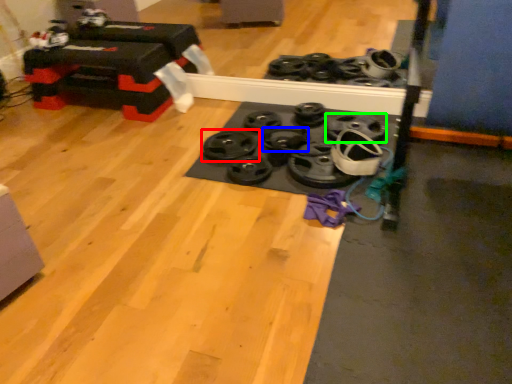
Question: Which object is positioned farthest from wheel (highlighted by a red box)? Select from wheel (highlighted by a blue box) and wheel (highlighted by a green box).

Choices:
 (A) wheel
 (B) wheel

Answer: (B)